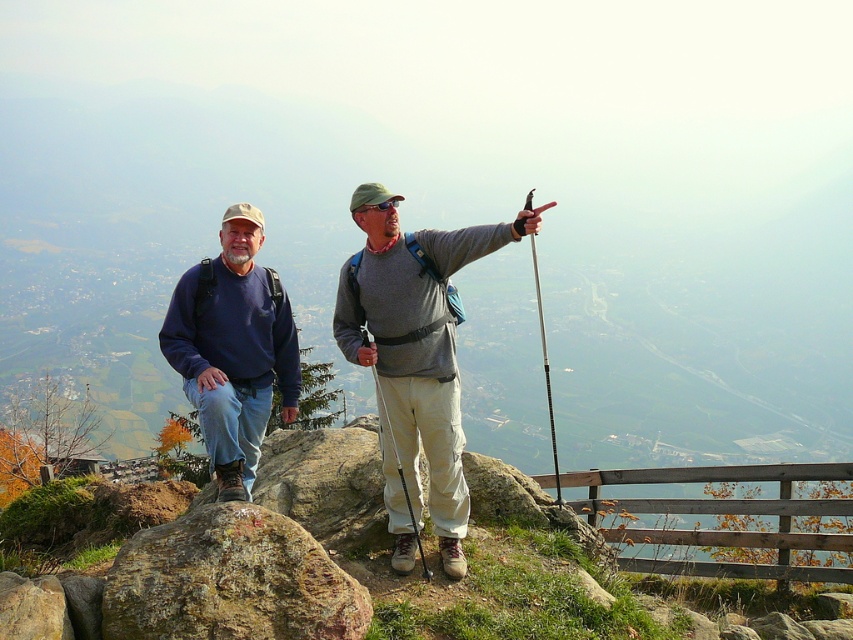
Does brown rough rock at lower left have a smaller size compared to matte blue sweatshirt at left?

Indeed, brown rough rock at lower left has a smaller size compared to matte blue sweatshirt at left.

Does point (201, 525) come closer to viewer compared to point (227, 467)?

Yes, it is.

Where is `brown rough rock at lower left`? The width and height of the screenshot is (853, 640). brown rough rock at lower left is located at coordinates [x=230, y=580].

Between gray fabric shirt at center and brown rough rock at lower left, which one has less height?

brown rough rock at lower left

Is gray fabric shirt at center bigger than brown rough rock at lower left?

Yes.

Which is behind, point (509, 228) or point (138, 568)?

The point (509, 228) is more distant.

At what (x,y) coordinates should I click in order to perform the action: click on gray fabric shirt at center. Please return your answer as a coordinate pair (x, y). Looking at the image, I should click on (415, 353).

Who is more forward, (407, 400) or (219, 316)?

Point (407, 400) is in front.

This screenshot has width=853, height=640. I want to click on gray fabric shirt at center, so pyautogui.click(x=415, y=353).